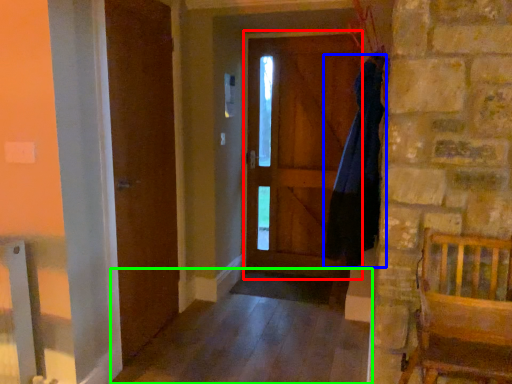
Question: Estimate the real-world distances between objects in this image. Which object is closer to screen door (highlighted by a red box), dress (highlighted by a blue box) or alley (highlighted by a green box)?

Choices:
 (A) dress
 (B) alley

Answer: (B)